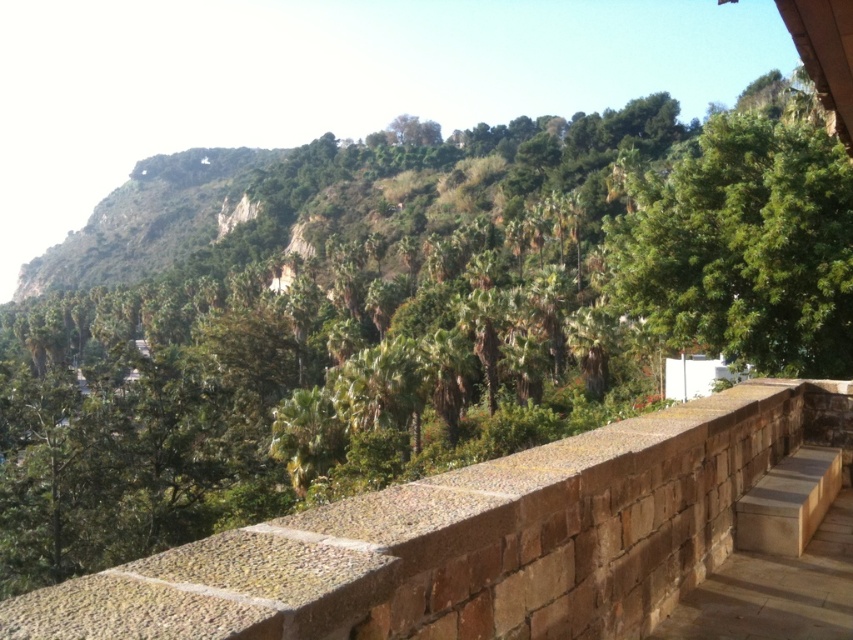
Can you confirm if brown stone ledge at center is smaller than green leafy tree at center?

Yes, brown stone ledge at center is smaller than green leafy tree at center.

Which is above, brown stone ledge at center or green leafy tree at center?

green leafy tree at center is above.

Where is `brown stone ledge at center`? This screenshot has height=640, width=853. brown stone ledge at center is located at coordinates (474, 540).